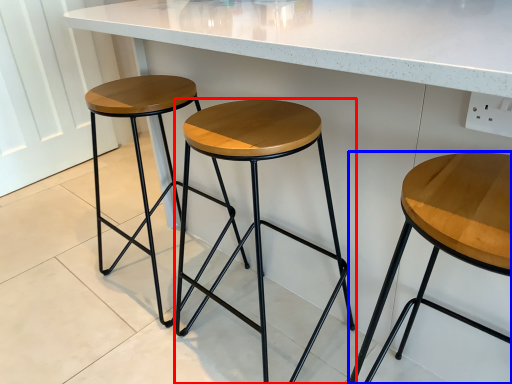
Question: Which object is closer to the camera taking this photo, stool (highlighted by a red box) or stool (highlighted by a blue box)?

Choices:
 (A) stool
 (B) stool

Answer: (B)